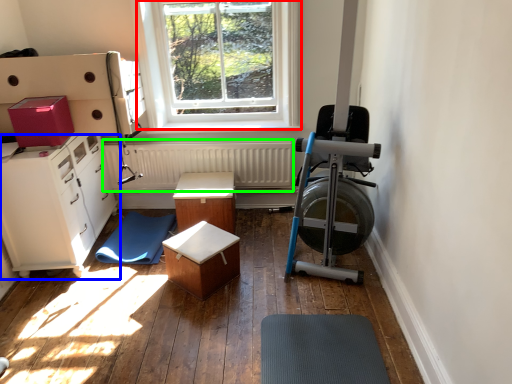
Question: Which object is positioned closest to window (highlighted by a red box)? Select from cabinetry (highlighted by a blue box) and radiator (highlighted by a green box).

Choices:
 (A) cabinetry
 (B) radiator

Answer: (B)